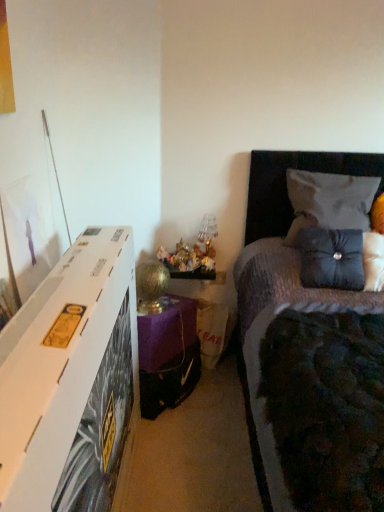
Question: Would you consider dark grey fabric bed at upper right to be distant from velvet gray pillow at upper right, placed as the 1th pillow when sorted from top to bottom?

Choices:
 (A) yes
 (B) no

Answer: (B)

Question: Is dark grey fabric bed at upper right positioned beyond the bounds of velvet gray pillow at upper right, placed as the 1th pillow when sorted from top to bottom?

Choices:
 (A) no
 (B) yes

Answer: (B)

Question: Is velvet gray pillow at upper right, the second pillow positioned from the bottom, at the back of dark grey fabric bed at upper right?

Choices:
 (A) yes
 (B) no

Answer: (A)

Question: Is dark grey fabric bed at upper right taller than velvet gray pillow at upper right, the second pillow positioned from the bottom?

Choices:
 (A) no
 (B) yes

Answer: (B)

Question: Does dark grey fabric bed at upper right have a lesser height compared to velvet gray pillow at upper right, placed as the 1th pillow when sorted from top to bottom?

Choices:
 (A) yes
 (B) no

Answer: (B)

Question: Does dark grey fabric bed at upper right appear on the right side of velvet gray pillow at upper right, placed as the 1th pillow when sorted from top to bottom?

Choices:
 (A) no
 (B) yes

Answer: (A)

Question: Is gold metallic table lamp at lower center at the right side of purple fabric nightstand at lower center?

Choices:
 (A) no
 (B) yes

Answer: (A)

Question: Would you say purple fabric nightstand at lower center is part of gold metallic table lamp at lower center's contents?

Choices:
 (A) no
 (B) yes

Answer: (A)

Question: From a real-world perspective, is gold metallic table lamp at lower center on top of purple fabric nightstand at lower center?

Choices:
 (A) no
 (B) yes

Answer: (B)

Question: Is gold metallic table lamp at lower center facing towards purple fabric nightstand at lower center?

Choices:
 (A) yes
 (B) no

Answer: (B)

Question: Considering the relative sizes of gold metallic table lamp at lower center and purple fabric nightstand at lower center in the image provided, is gold metallic table lamp at lower center taller than purple fabric nightstand at lower center?

Choices:
 (A) no
 (B) yes

Answer: (B)

Question: Is gold metallic table lamp at lower center smaller than purple fabric nightstand at lower center?

Choices:
 (A) no
 (B) yes

Answer: (B)

Question: Is gold metallic table lamp at lower center not within velvet gray pillow at upper right, the second pillow positioned from the bottom?

Choices:
 (A) yes
 (B) no

Answer: (A)